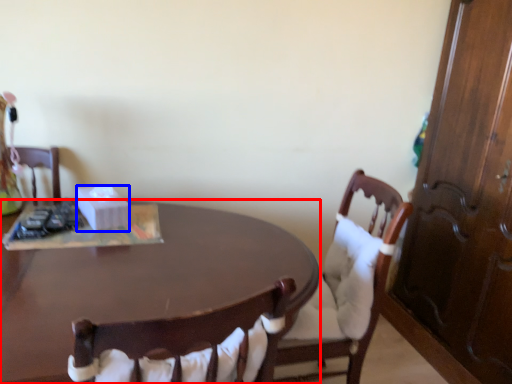
Question: Which point is further to the camera, desk (highlighted by a red box) or box (highlighted by a blue box)?

Choices:
 (A) desk
 (B) box

Answer: (B)